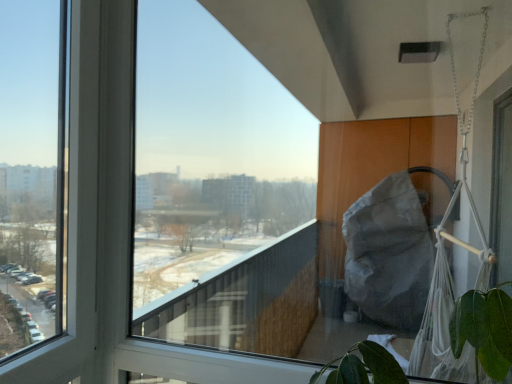
Where is `transparent glass window at left`? This screenshot has height=384, width=512. transparent glass window at left is located at coordinates (32, 171).

Describe the element at coordinates (32, 171) in the screenshot. I see `transparent glass window at left` at that location.

In order to face transparent glass window at left, should I rotate leftwards or rightwards?

Turn left approximately 24.031 degrees to face it.

You are a GUI agent. You are given a task and a screenshot of the screen. Output one action in this format:
    pyautogui.click(x=<x>, y=<y>)
    Task: Click on the transparent glass window at left
    The height and width of the screenshot is (384, 512).
    Given the screenshot: What is the action you would take?
    pyautogui.click(x=32, y=171)